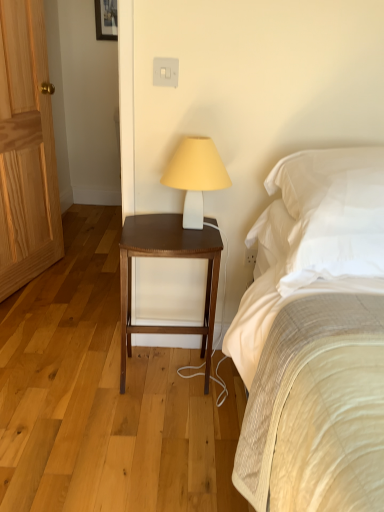
Image resolution: width=384 pixels, height=512 pixels. Describe the element at coordinates (169, 257) in the screenshot. I see `dark wood nightstand at center` at that location.

Find the location of `white matte table lamp at upper center`. white matte table lamp at upper center is located at coordinates (195, 176).

How far apart are natural wood door at left and white soft pillow at upper right?

natural wood door at left and white soft pillow at upper right are 1.62 meters apart from each other.

Which object is wider, natural wood door at left or white soft pillow at upper right?

With larger width is white soft pillow at upper right.

Considering the sizes of objects natural wood door at left and white soft pillow at upper right in the image provided, who is shorter, natural wood door at left or white soft pillow at upper right?

Standing shorter between the two is white soft pillow at upper right.

From a real-world perspective, is natural wood door at left below white soft pillow at upper right?

Actually, natural wood door at left is physically above white soft pillow at upper right in the real world.

Based on their positions, is dark wood nightstand at center located to the left or right of white soft pillow at upper right?

From the image, it's evident that dark wood nightstand at center is to the left of white soft pillow at upper right.

Can you see dark wood nightstand at center touching white soft pillow at upper right?

dark wood nightstand at center and white soft pillow at upper right are clearly separated.

Which object is more forward, dark wood nightstand at center or white soft pillow at upper right?

Positioned in front is white soft pillow at upper right.

Who is bigger, dark wood nightstand at center or white soft pillow at upper right?

dark wood nightstand at center.

Would you say white soft pillow at upper right contains dark wood nightstand at center?

No, dark wood nightstand at center is not inside white soft pillow at upper right.

From the image's perspective, which one is positioned lower, white soft pillow at upper right or dark wood nightstand at center?

dark wood nightstand at center is shown below in the image.

Is white soft pillow at upper right with dark wood nightstand at center?

No, white soft pillow at upper right is not next to dark wood nightstand at center.

Which object is further away from the camera taking this photo, white soft pillow at upper right or white matte table lamp at upper center?

white matte table lamp at upper center is further away from the camera.

Is white soft pillow at upper right not near white matte table lamp at upper center?

That's not correct — white soft pillow at upper right is a little close to white matte table lamp at upper center.

From a real-world perspective, is white soft pillow at upper right on top of white matte table lamp at upper center?

No, from a real-world perspective, white soft pillow at upper right is not on top of white matte table lamp at upper center.

Which is closer, (352,197) or (204,159)?

The point (352,197) is more forward.

Is white soft pillow at upper right inside white matte table lamp at upper center?

Actually, white soft pillow at upper right is outside white matte table lamp at upper center.

Which is more to the left, white matte table lamp at upper center or white soft pillow at upper right?

white matte table lamp at upper center.

How different are the orientations of white matte table lamp at upper center and white soft pillow at upper right in degrees?

The angular difference between white matte table lamp at upper center and white soft pillow at upper right is 4.7 degrees.

Is white matte table lamp at upper center next to white soft pillow at upper right?

No, white matte table lamp at upper center is not with white soft pillow at upper right.

From a real-world perspective, is dark wood nightstand at center positioned above or below white matte table lamp at upper center?

dark wood nightstand at center is below white matte table lamp at upper center.

From the image's perspective, which object appears higher, dark wood nightstand at center or white matte table lamp at upper center?

white matte table lamp at upper center.

Who is smaller, dark wood nightstand at center or white matte table lamp at upper center?

white matte table lamp at upper center is smaller.

Between dark wood nightstand at center and white matte table lamp at upper center, which one has smaller width?

Thinner between the two is white matte table lamp at upper center.

Visually, is natural wood door at left positioned to the left or to the right of dark wood nightstand at center?

Based on their positions, natural wood door at left is located to the left of dark wood nightstand at center.

In the image, is natural wood door at left positioned in front of or behind dark wood nightstand at center?

natural wood door at left is positioned farther from the viewer than dark wood nightstand at center.

Is natural wood door at left facing towards dark wood nightstand at center?

Yes, natural wood door at left is turned towards dark wood nightstand at center.

Where is `pillow to the right of natural wood door at left`? The width and height of the screenshot is (384, 512). pillow to the right of natural wood door at left is located at coordinates (333, 225).

The height and width of the screenshot is (512, 384). I want to click on nightstand directly beneath the white soft pillow at upper right (from a real-world perspective), so click(x=169, y=257).

Which object lies further to the anchor point white matte table lamp at upper center, dark wood nightstand at center or natural wood door at left?

Among the two, natural wood door at left is located further to white matte table lamp at upper center.

Based on the photo, considering their positions, is natural wood door at left positioned further to white soft pillow at upper right than dark wood nightstand at center?

Among the two, natural wood door at left is located further to white soft pillow at upper right.

From the image, which object appears to be farther from natural wood door at left, white soft pillow at upper right or dark wood nightstand at center?

Based on the image, white soft pillow at upper right appears to be further to natural wood door at left.

From the image, which object appears to be farther from white soft pillow at upper right, white matte table lamp at upper center or dark wood nightstand at center?

dark wood nightstand at center lies further to white soft pillow at upper right than the other object.

In the scene shown: From the image, which object appears to be nearer to dark wood nightstand at center, natural wood door at left or white soft pillow at upper right?

Based on the image, white soft pillow at upper right appears to be nearer to dark wood nightstand at center.

Estimate the real-world distances between objects in this image. Which object is closer to white matte table lamp at upper center, natural wood door at left or white soft pillow at upper right?

Among the two, white soft pillow at upper right is located nearer to white matte table lamp at upper center.

Estimate the real-world distances between objects in this image. Which object is further from natural wood door at left, white matte table lamp at upper center or white soft pillow at upper right?

white soft pillow at upper right is further to natural wood door at left.

From the image, which object appears to be farther from white soft pillow at upper right, dark wood nightstand at center or white matte table lamp at upper center?

Based on the image, dark wood nightstand at center appears to be further to white soft pillow at upper right.

At what (x,y) coordinates should I click in order to perform the action: click on nightstand between natural wood door at left and white soft pillow at upper right. Please return your answer as a coordinate pair (x, y). Image resolution: width=384 pixels, height=512 pixels. Looking at the image, I should click on (169, 257).

Image resolution: width=384 pixels, height=512 pixels. What are the coordinates of `table lamp between dark wood nightstand at center and white soft pillow at upper right in the horizontal direction` in the screenshot? It's located at (195, 176).

Locate an element on the screen. table lamp between natural wood door at left and white soft pillow at upper right is located at coordinates (195, 176).

Locate an element on the screen. The width and height of the screenshot is (384, 512). nightstand situated between natural wood door at left and white matte table lamp at upper center from left to right is located at coordinates (169, 257).